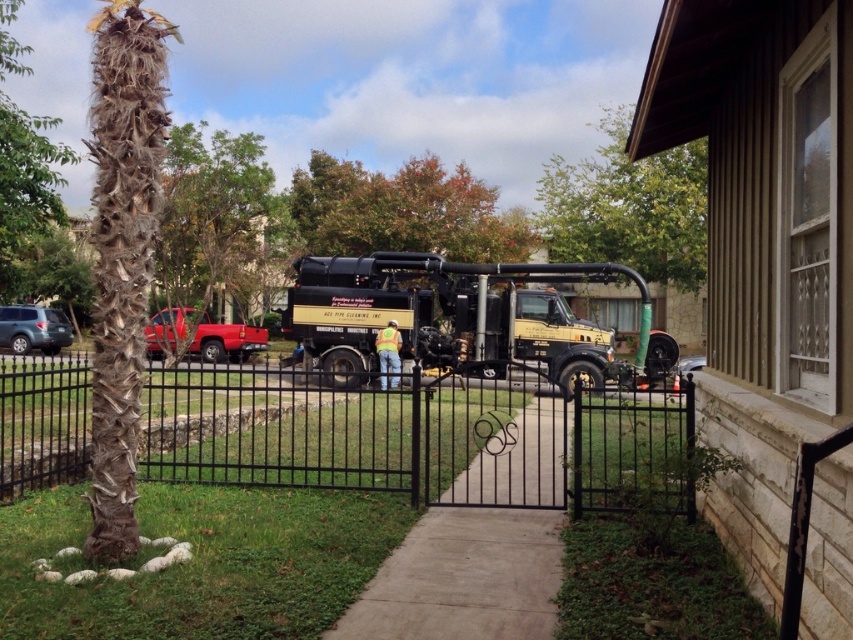
Between brown/scaly palm tree at left and green leafy tree at upper center, which one is positioned lower?

brown/scaly palm tree at left

Between brown/scaly palm tree at left and green leafy tree at upper center, which one has more height?

green leafy tree at upper center is taller.

This screenshot has height=640, width=853. In order to click on brown/scaly palm tree at left in this screenshot , I will do `click(122, 252)`.

Who is more distant from viewer, (509, 480) or (437, 264)?

Point (437, 264)

Is black metal gate at center closer to camera compared to gold metallic trailer truck at center?

That is True.

Who is more forward, (70, 401) or (424, 364)?

Positioned in front is point (70, 401).

Identify the location of black metal gate at center. The height and width of the screenshot is (640, 853). (397, 433).

Can you confirm if gold metallic trailer truck at center is positioned to the left of green leafy tree at upper center?

Correct, you'll find gold metallic trailer truck at center to the left of green leafy tree at upper center.

Measure the distance between gold metallic trailer truck at center and camera.

They are 56.21 feet apart.

This screenshot has width=853, height=640. What are the coordinates of `gold metallic trailer truck at center` in the screenshot? It's located at [x=444, y=314].